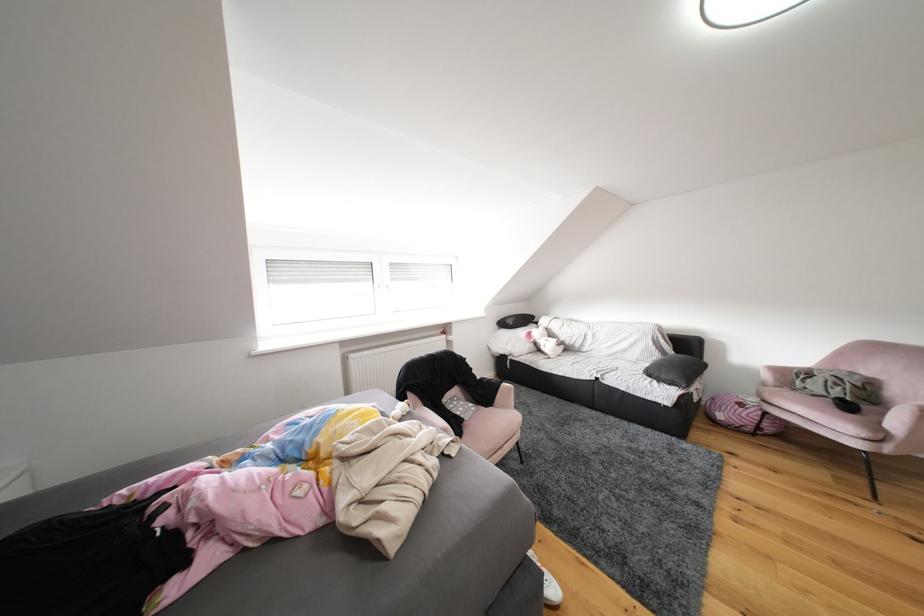
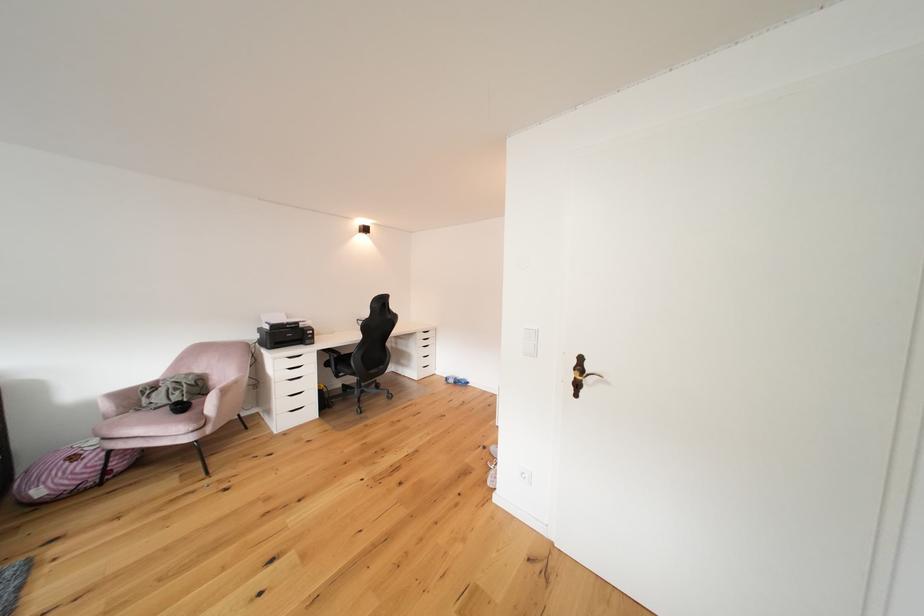
Locate, in the second image, the point that corresponds to (x=874, y=377) in the first image.

(208, 374)